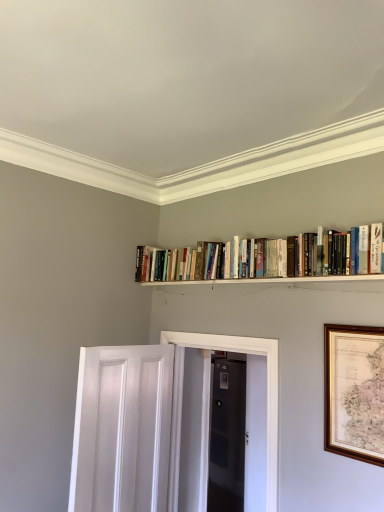
Question: Does black glossy door at center, the first door in the right-to-left sequence, have a lesser height compared to white glossy elevator at center?

Choices:
 (A) no
 (B) yes

Answer: (A)

Question: Does black glossy door at center, the 2th door positioned from the left, have a lesser width compared to white glossy elevator at center?

Choices:
 (A) no
 (B) yes

Answer: (B)

Question: Is black glossy door at center, the 2th door positioned from the left, not inside white glossy elevator at center?

Choices:
 (A) no
 (B) yes

Answer: (B)

Question: Considering the relative positions of black glossy door at center, which is counted as the 2th door, starting from the front, and white glossy elevator at center in the image provided, is black glossy door at center, which is counted as the 2th door, starting from the front, to the left of white glossy elevator at center from the viewer's perspective?

Choices:
 (A) no
 (B) yes

Answer: (A)

Question: Is black glossy door at center, the first door in the right-to-left sequence, facing towards white glossy elevator at center?

Choices:
 (A) yes
 (B) no

Answer: (B)

Question: From the image's perspective, is black glossy door at center, the first door in the right-to-left sequence, above white glossy elevator at center?

Choices:
 (A) yes
 (B) no

Answer: (B)

Question: Is white wooden shelf at upper center looking in the opposite direction of white glossy elevator at center?

Choices:
 (A) no
 (B) yes

Answer: (A)

Question: Considering the relative positions of white wooden shelf at upper center and white glossy elevator at center in the image provided, is white wooden shelf at upper center in front of white glossy elevator at center?

Choices:
 (A) yes
 (B) no

Answer: (A)

Question: From a real-world perspective, is white wooden shelf at upper center positioned under white glossy elevator at center based on gravity?

Choices:
 (A) no
 (B) yes

Answer: (A)

Question: Does white wooden shelf at upper center have a smaller size compared to white glossy elevator at center?

Choices:
 (A) no
 (B) yes

Answer: (B)

Question: Is white glossy elevator at center inside white wooden shelf at upper center?

Choices:
 (A) yes
 (B) no

Answer: (B)

Question: Is white wooden shelf at upper center thinner than white glossy elevator at center?

Choices:
 (A) no
 (B) yes

Answer: (B)

Question: Considering the relative sizes of wooden framed map at right and white painted wood door at lower left, placed as the 2th door when sorted from back to front, in the image provided, is wooden framed map at right shorter than white painted wood door at lower left, placed as the 2th door when sorted from back to front,?

Choices:
 (A) yes
 (B) no

Answer: (A)